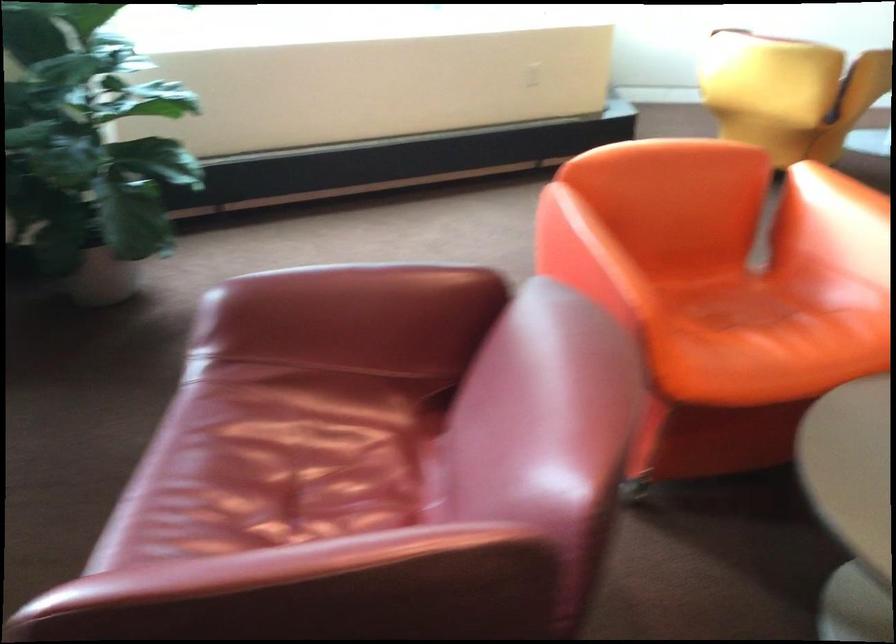
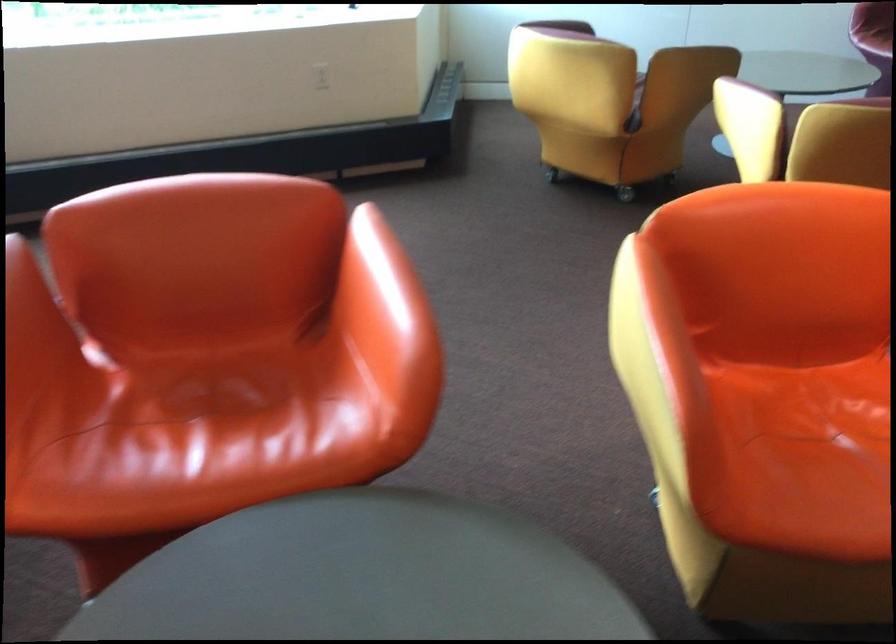
Locate, in the second image, the point that corresponds to [713,301] in the first image.

(208, 384)